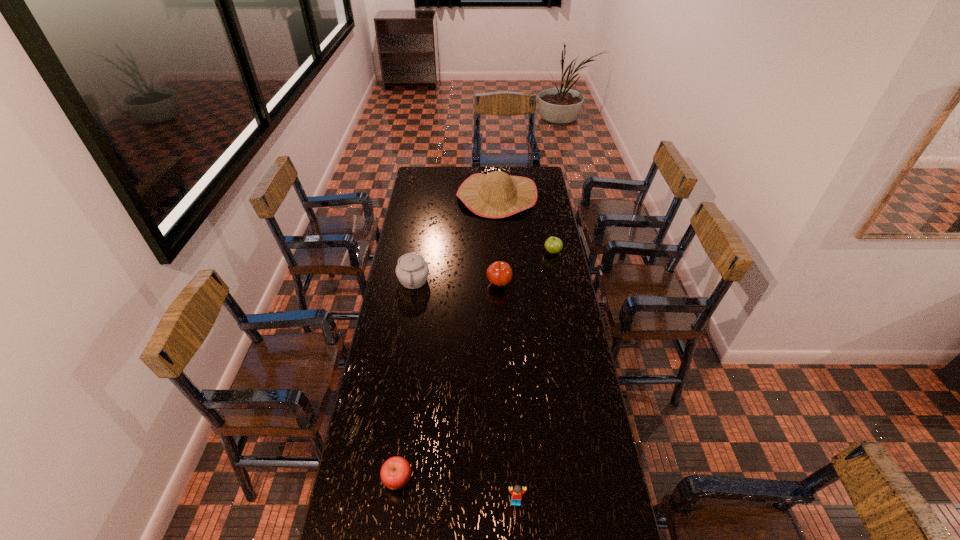
Locate an element on the screen. The image size is (960, 540). object at the far right corner is located at coordinates (494, 195).

Locate an element on the screen. free space at the left edge of the desktop is located at coordinates (353, 495).

Locate an element on the screen. blank space at the right edge of the desktop is located at coordinates (544, 201).

In the image, there is a desktop. Where is `vacant space at the far left corner`? This screenshot has height=540, width=960. vacant space at the far left corner is located at coordinates (420, 168).

In the image, there is a desktop. Where is `vacant space at the far right corner`? Image resolution: width=960 pixels, height=540 pixels. vacant space at the far right corner is located at coordinates (536, 177).

Image resolution: width=960 pixels, height=540 pixels. I want to click on free spot between the rightmost apple and the farthest object, so click(x=525, y=224).

Locate an element on the screen. vacant point located between the rightmost apple and the tallest apple is located at coordinates (526, 268).

Locate an element on the screen. vacant area between the fifth nearest object and the chinaware is located at coordinates (483, 266).

Image resolution: width=960 pixels, height=540 pixels. What are the coordinates of `vacant area that lies between the sunhat and the Lego` in the screenshot? It's located at (506, 349).

Where is `free area in between the nearest apple and the second farthest object`? The image size is (960, 540). free area in between the nearest apple and the second farthest object is located at coordinates (475, 366).